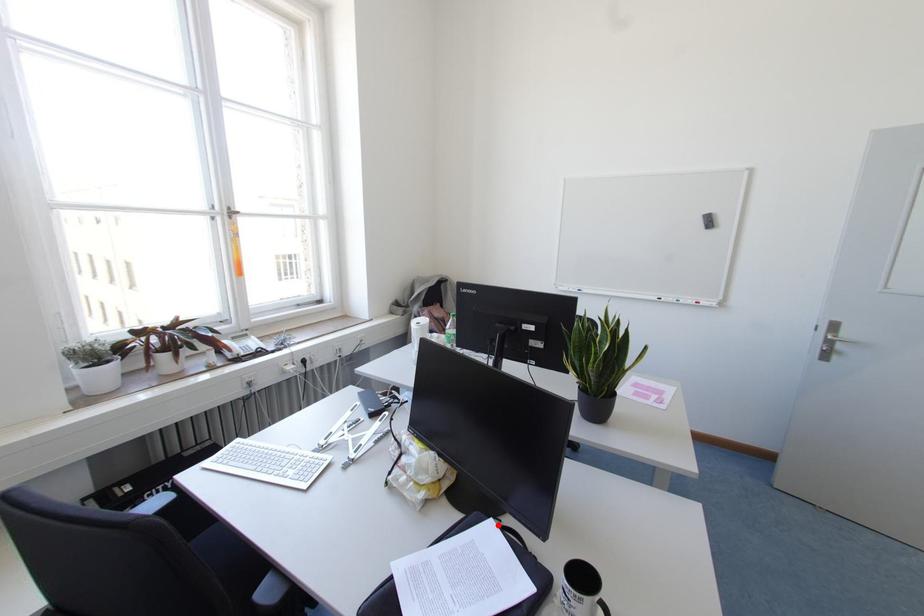
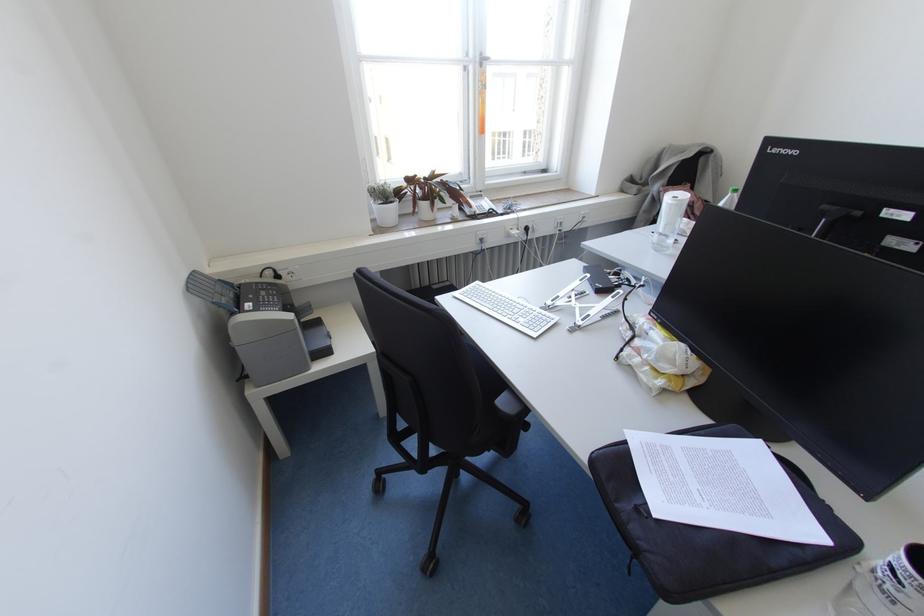
Where in the second image is the point corresponding to the highlighted location from the first image?

(762, 454)